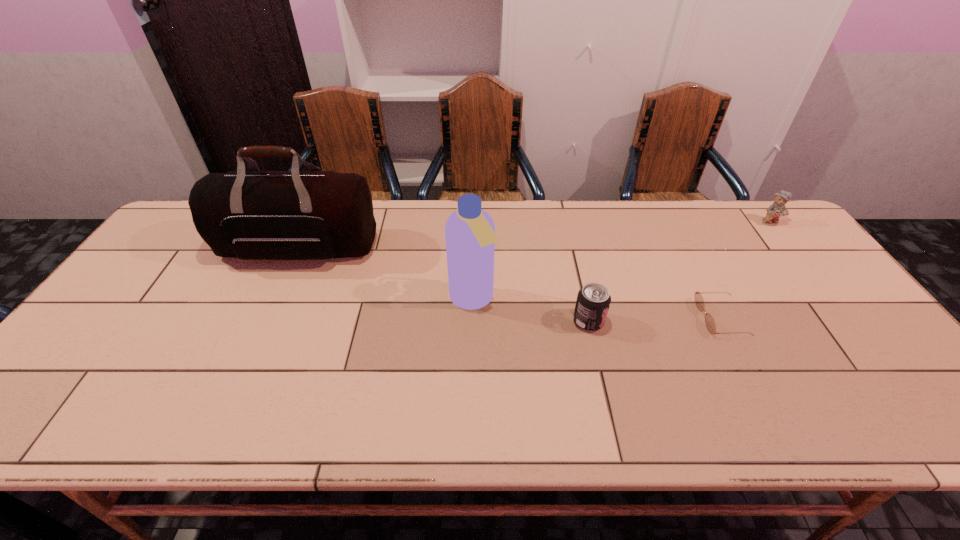
This screenshot has height=540, width=960. What are the coordinates of `unoccupied area between the second object from right to left and the leftmost object` in the screenshot? It's located at (510, 282).

Locate an element on the screen. The width and height of the screenshot is (960, 540). free spot between the leftmost object and the soda can is located at coordinates [444, 285].

What are the coordinates of `object that is the fourth closest one to the leftmost object` in the screenshot? It's located at (777, 209).

Select which object is the fourth closest to the leftmost object. Please provide its 2D coordinates. Your answer should be formatted as a tuple, i.e. [(x, y)], where the tuple contains the x and y coordinates of a point satisfying the conditions above.

[(777, 209)]

At what (x,y) coordinates should I click in order to perform the action: click on vacant space that satisfies the following two spatial constraints: 1. on the front pocket of the second object from left to right; 2. on the right side of the leftmost object. Please return your answer as a coordinate pair (x, y). The image size is (960, 540). Looking at the image, I should click on (276, 300).

Identify the location of vacant area in the image that satisfies the following two spatial constraints: 1. on the front pocket of the fourth object from right to left; 2. on the left side of the leftmost object. coord(276,300).